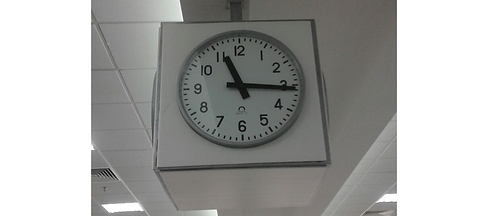
This screenshot has width=502, height=216. Identify the location of vent. (103, 174).